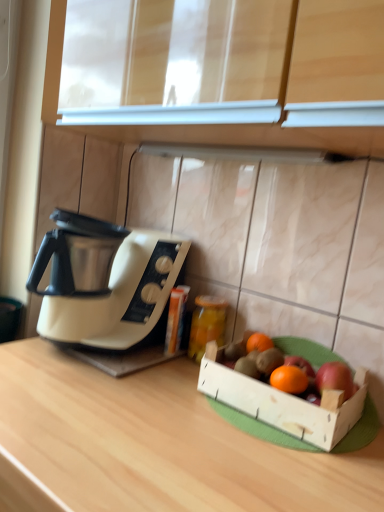
You are a GUI agent. You are given a task and a screenshot of the screen. Output one action in this format:
    pyautogui.click(x=<x>, y=<y>)
    Task: Click on the free point above white glossy exhaust hood at center (from a real-world perspective)
    The width and height of the screenshot is (384, 512).
    Given the screenshot: What is the action you would take?
    pyautogui.click(x=224, y=148)